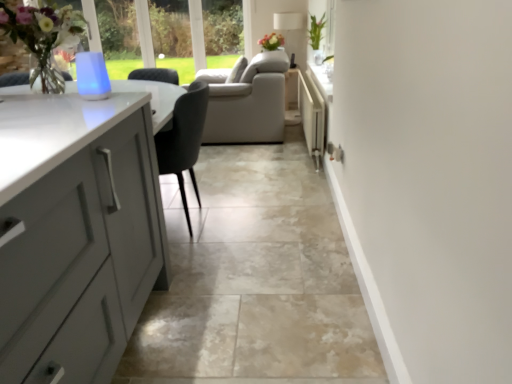
At what (x,y) coordinates should I click in order to perform the action: click on white glossy lampshade at upper center. Please return your answer as a coordinate pair (x, y). This screenshot has width=512, height=384. Looking at the image, I should click on (287, 20).

The image size is (512, 384). Identify the location of matte gray cabinets at left. point(255,279).

I want to click on green leafy plant at upper right, so click(316, 31).

Where is `white glossy lampshade at upper center`? This screenshot has width=512, height=384. white glossy lampshade at upper center is located at coordinates (287, 20).

Who is bigger, matte floral arrangement at center or matte gray cabinets at left?

matte gray cabinets at left.

From the image's perspective, is matte floral arrangement at center positioned above or below matte gray cabinets at left?

matte floral arrangement at center is above matte gray cabinets at left.

Locate an element on the screen. Image resolution: width=512 pixels, height=384 pixels. path that appears below the matte floral arrangement at center (from the image's perspective) is located at coordinates (255, 279).

Which is less distant, (269, 49) or (342, 284)?

Clearly, point (269, 49) is more distant from the camera than point (342, 284).

Who is more distant, white plastic radiator at center-right or white glossy lampshade at upper center?

white glossy lampshade at upper center is further away from the camera.

Can you confirm if white plastic radiator at center-right is taller than white glossy lampshade at upper center?

No, white plastic radiator at center-right is not taller than white glossy lampshade at upper center.

From a real-world perspective, which object stands above the other?

white glossy lampshade at upper center.

Considering the sizes of objects white plastic radiator at center-right and white glossy lampshade at upper center in the image provided, who is smaller, white plastic radiator at center-right or white glossy lampshade at upper center?

Smaller between the two is white glossy lampshade at upper center.

Can you confirm if white glossy lampshade at upper center is thinner than matte gray cabinets at left?

Yes, white glossy lampshade at upper center is thinner than matte gray cabinets at left.

Considering the relative positions of white glossy lampshade at upper center and matte gray cabinets at left in the image provided, is white glossy lampshade at upper center to the left or to the right of matte gray cabinets at left?

white glossy lampshade at upper center is positioned on matte gray cabinets at left's right side.

Could you tell me if white glossy lampshade at upper center is turned towards matte gray cabinets at left?

No, white glossy lampshade at upper center is not facing towards matte gray cabinets at left.

Can you confirm if white glossy lampshade at upper center is thinner than white plastic radiator at center-right?

No, white glossy lampshade at upper center is not thinner than white plastic radiator at center-right.

Who is shorter, white glossy lampshade at upper center or white plastic radiator at center-right?

white plastic radiator at center-right.

Considering the positions of points (276, 28) and (324, 131), is point (276, 28) farther from camera compared to point (324, 131)?

Yes, point (276, 28) is farther from viewer.

At what (x,y) coordinates should I click in order to perform the action: click on lamp above the white plastic radiator at center-right (from the image's perspective). Please return your answer as a coordinate pair (x, y). The width and height of the screenshot is (512, 384). Looking at the image, I should click on (287, 20).

From the image's perspective, between matte floral arrangement at center and white plastic radiator at center-right, which one is located above?

matte floral arrangement at center.

Is the depth of matte floral arrangement at center greater than that of white plastic radiator at center-right?

Yes, the depth of matte floral arrangement at center is greater than that of white plastic radiator at center-right.

Locate an element on the screen. Image resolution: width=512 pixels, height=384 pixels. flower above the white plastic radiator at center-right (from the image's perspective) is located at coordinates (271, 41).

Considering the positions of objects matte gray cabinets at left and white plastic radiator at center-right in the image provided, who is more to the right, matte gray cabinets at left or white plastic radiator at center-right?

white plastic radiator at center-right.

Can you confirm if matte gray cabinets at left is shorter than white plastic radiator at center-right?

Yes.

Do you think matte gray cabinets at left is within white plastic radiator at center-right, or outside of it?

The correct answer is: outside.

Does white plastic radiator at center-right turn towards green leafy plant at upper right?

No, white plastic radiator at center-right is not facing towards green leafy plant at upper right.

Identify the location of plant above the white plastic radiator at center-right (from a real-world perspective). (316, 31).

Can you confirm if white plastic radiator at center-right is thinner than green leafy plant at upper right?

Indeed, white plastic radiator at center-right has a lesser width compared to green leafy plant at upper right.

How far apart are white plastic radiator at center-right and green leafy plant at upper right?

white plastic radiator at center-right and green leafy plant at upper right are 86.60 centimeters apart from each other.

This screenshot has height=384, width=512. I want to click on path directly beneath the matte floral arrangement at center (from a real-world perspective), so click(255, 279).

This screenshot has height=384, width=512. Find the location of `appliance on the right of white glossy lampshade at upper center`. appliance on the right of white glossy lampshade at upper center is located at coordinates (312, 116).

Estimate the real-world distances between objects in this image. Which object is further from white plastic radiator at center-right, white glossy lampshade at upper center or green leafy plant at upper right?

Among the two, white glossy lampshade at upper center is located further to white plastic radiator at center-right.

Based on their spatial positions, is matte gray cabinets at left or white glossy lampshade at upper center further from green leafy plant at upper right?

Based on the image, matte gray cabinets at left appears to be further to green leafy plant at upper right.

Estimate the real-world distances between objects in this image. Which object is further from green leafy plant at upper right, matte gray cabinets at left or matte floral arrangement at center?

The object further to green leafy plant at upper right is matte gray cabinets at left.

Which object lies nearer to the anchor point matte gray cabinets at left, matte floral arrangement at center or white glossy lampshade at upper center?

Based on the image, matte floral arrangement at center appears to be nearer to matte gray cabinets at left.

Based on their spatial positions, is white glossy lampshade at upper center or matte gray cabinets at left further from white plastic radiator at center-right?

Among the two, white glossy lampshade at upper center is located further to white plastic radiator at center-right.

Looking at the image, which one is located closer to matte floral arrangement at center, white plastic radiator at center-right or matte gray cabinets at left?

white plastic radiator at center-right is closer to matte floral arrangement at center.

Looking at this image, looking at the image, which one is located further to white glossy lampshade at upper center, matte gray cabinets at left or white plastic radiator at center-right?

matte gray cabinets at left lies further to white glossy lampshade at upper center than the other object.

Which object lies nearer to the anchor point matte floral arrangement at center, white plastic radiator at center-right or white glossy lampshade at upper center?

Based on the image, white glossy lampshade at upper center appears to be nearer to matte floral arrangement at center.

The height and width of the screenshot is (384, 512). In order to click on appliance between matte gray cabinets at left and matte floral arrangement at center from front to back in this screenshot , I will do `click(312, 116)`.

This screenshot has height=384, width=512. What are the coordinates of `flower located between white plastic radiator at center-right and white glossy lampshade at upper center in the depth direction` in the screenshot? It's located at (271, 41).

Identify the location of plant between white plastic radiator at center-right and white glossy lampshade at upper center in the front-back direction. Image resolution: width=512 pixels, height=384 pixels. (316, 31).

Identify the location of plant between white plastic radiator at center-right and matte floral arrangement at center along the z-axis. (316, 31).